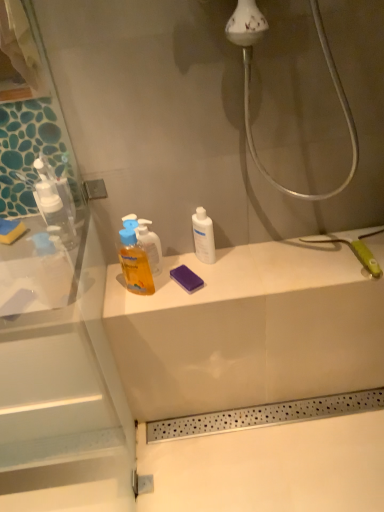
Image resolution: width=384 pixels, height=512 pixels. Find the location of `blank area to the left of translucent plastic bottle at center`. blank area to the left of translucent plastic bottle at center is located at coordinates (114, 294).